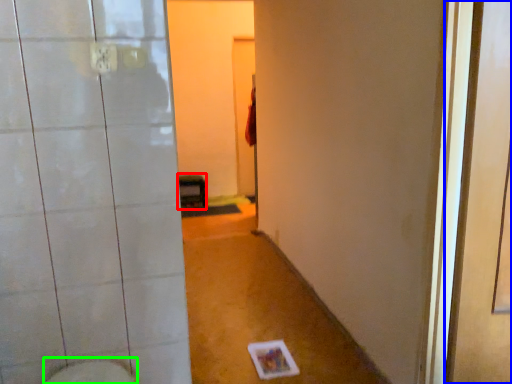
Question: Which is nearer to the furniture (highlighted by a red box)? screen door (highlighted by a blue box) or bidet (highlighted by a green box).

Choices:
 (A) screen door
 (B) bidet

Answer: (B)